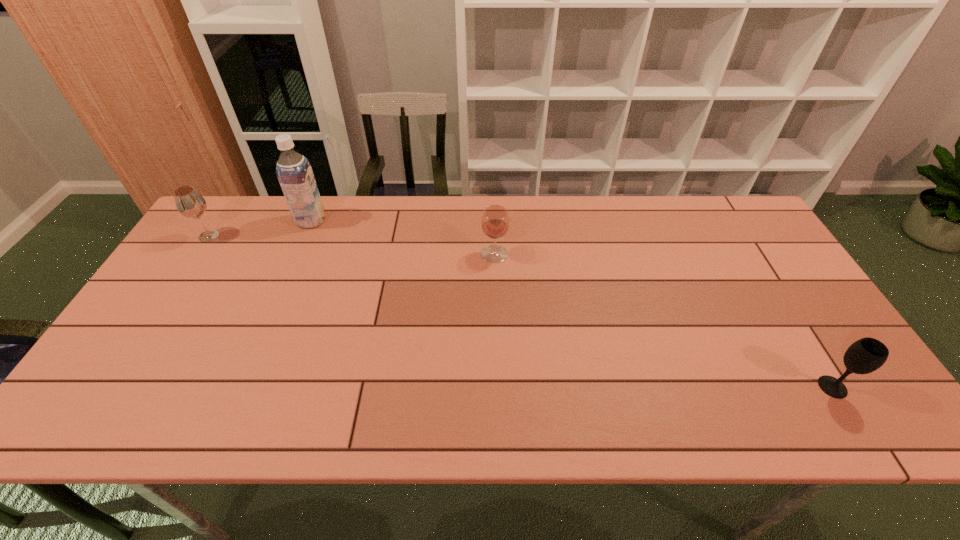
This screenshot has width=960, height=540. In order to click on blank space located 0.250m on the front of the third farthest object in this screenshot , I will do `click(497, 333)`.

This screenshot has height=540, width=960. Identify the location of vacant space located 0.360m on the back of the rightmost wineglass. (758, 267).

The image size is (960, 540). Find the location of `soya milk that is at the far edge`. soya milk that is at the far edge is located at coordinates (294, 172).

Where is `wineglass that is at the far edge`? wineglass that is at the far edge is located at coordinates coord(189,202).

In order to click on object present at the near edge in this screenshot , I will do `click(866, 355)`.

The height and width of the screenshot is (540, 960). Identify the location of object located at the left edge. (189, 202).

What are the coordinates of `object that is positioned at the right edge` in the screenshot? It's located at (866, 355).

Find the location of a particular element. object that is at the far left corner is located at coordinates (189, 202).

Find the location of `object situated at the near right corner`. object situated at the near right corner is located at coordinates (866, 355).

In the image, there is a desktop. Where is `vacant space at the far edge`? vacant space at the far edge is located at coordinates (437, 240).